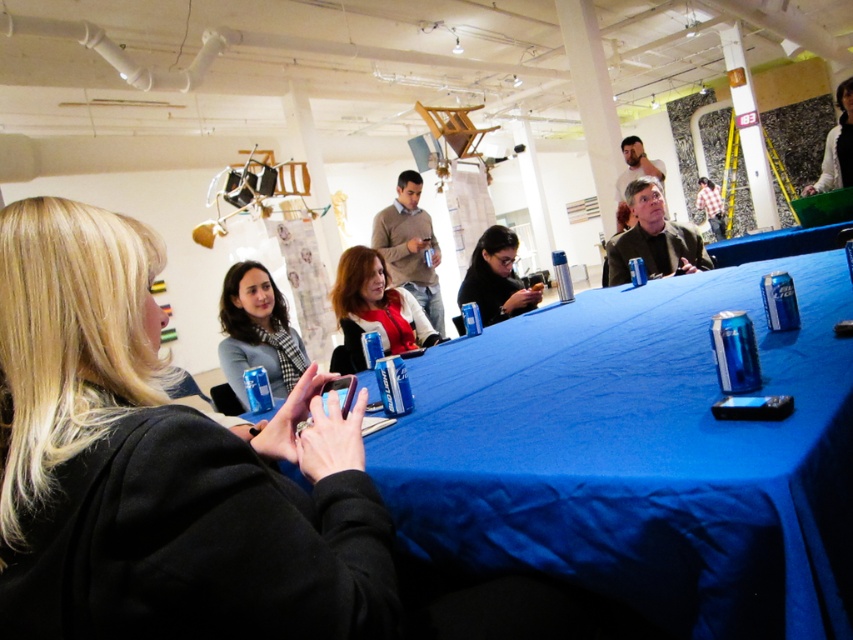
Between blue fabric table at center and matte gray scarf at center, which one is positioned lower?

Positioned lower is blue fabric table at center.

What do you see at coordinates (641, 456) in the screenshot? The height and width of the screenshot is (640, 853). I see `blue fabric table at center` at bounding box center [641, 456].

Who is more distant from viewer, (715,428) or (263,323)?

Point (263,323)

Where is `blue fabric table at center`? This screenshot has height=640, width=853. blue fabric table at center is located at coordinates (641, 456).

Is blonde hair at center to the left of white fabric jacket at upper right from the viewer's perspective?

Indeed, blonde hair at center is positioned on the left side of white fabric jacket at upper right.

Is point (86, 502) positioned in front of point (839, 154)?

Yes, it is in front of point (839, 154).

Image resolution: width=853 pixels, height=640 pixels. I want to click on blonde hair at center, so click(160, 467).

Can you confirm if blue fabric table at center is positioned to the right of matte black phone at center?

Yes, blue fabric table at center is to the right of matte black phone at center.

Describe the element at coordinates (641, 456) in the screenshot. Image resolution: width=853 pixels, height=640 pixels. I see `blue fabric table at center` at that location.

Where is `blue fabric table at center`? blue fabric table at center is located at coordinates (641, 456).